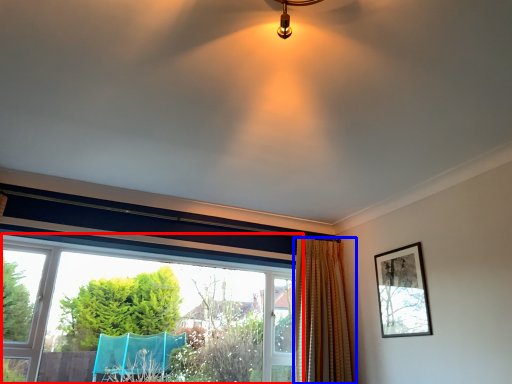
Question: Which point is closer to the camera, window (highlighted by a red box) or curtain (highlighted by a blue box)?

Choices:
 (A) window
 (B) curtain

Answer: (A)